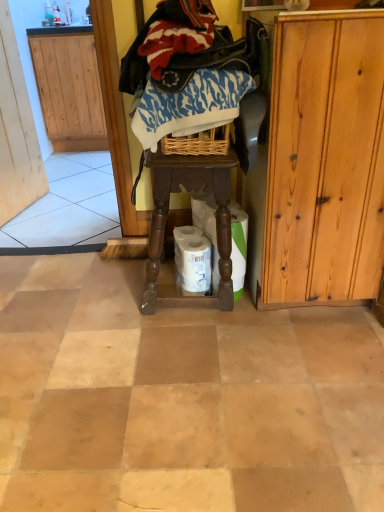
Question: Which direction should I rotate to face blue printed fabric at center, which is the 2th clothing in top-to-bottom order, — up or down?

Choices:
 (A) up
 (B) down

Answer: (A)

Question: Can you confirm if knitted wool sweater at upper center, placed as the first clothing when sorted from top to bottom, is wider than wooden screen door at left?

Choices:
 (A) no
 (B) yes

Answer: (B)

Question: Is knitted wool sweater at upper center, acting as the 2th clothing starting from the bottom, thinner than wooden screen door at left?

Choices:
 (A) yes
 (B) no

Answer: (B)

Question: Is knitted wool sweater at upper center, placed as the first clothing when sorted from top to bottom, at the right side of wooden screen door at left?

Choices:
 (A) yes
 (B) no

Answer: (A)

Question: Is the position of knitted wool sweater at upper center, acting as the 2th clothing starting from the bottom, more distant than that of wooden screen door at left?

Choices:
 (A) yes
 (B) no

Answer: (B)

Question: Is knitted wool sweater at upper center, acting as the 2th clothing starting from the bottom, positioned in front of wooden screen door at left?

Choices:
 (A) yes
 (B) no

Answer: (A)

Question: Could wooden screen door at left be considered to be inside knitted wool sweater at upper center, placed as the first clothing when sorted from top to bottom?

Choices:
 (A) yes
 (B) no

Answer: (B)

Question: Is knitted wool sweater at upper center, placed as the first clothing when sorted from top to bottom, taller than white matte toilet paper at center, acting as the 1th toilet paper starting from the right?

Choices:
 (A) yes
 (B) no

Answer: (B)

Question: From a real-world perspective, is knitted wool sweater at upper center, acting as the 2th clothing starting from the bottom, located higher than white matte toilet paper at center, which is the second toilet paper from left to right?

Choices:
 (A) yes
 (B) no

Answer: (A)

Question: Considering the relative positions of knitted wool sweater at upper center, placed as the first clothing when sorted from top to bottom, and white matte toilet paper at center, which is the second toilet paper from left to right, in the image provided, is knitted wool sweater at upper center, placed as the first clothing when sorted from top to bottom, to the right of white matte toilet paper at center, which is the second toilet paper from left to right, from the viewer's perspective?

Choices:
 (A) no
 (B) yes

Answer: (A)

Question: Can you confirm if knitted wool sweater at upper center, placed as the first clothing when sorted from top to bottom, is wider than white matte toilet paper at center, which is the second toilet paper from left to right?

Choices:
 (A) yes
 (B) no

Answer: (A)

Question: From the image's perspective, is knitted wool sweater at upper center, acting as the 2th clothing starting from the bottom, located beneath white matte toilet paper at center, acting as the 1th toilet paper starting from the right?

Choices:
 (A) yes
 (B) no

Answer: (B)

Question: Is knitted wool sweater at upper center, acting as the 2th clothing starting from the bottom, thinner than white matte toilet paper at center, acting as the 1th toilet paper starting from the right?

Choices:
 (A) yes
 (B) no

Answer: (B)

Question: From the image's perspective, is wooden screen door at left located above knitted wool sweater at upper center, acting as the 2th clothing starting from the bottom?

Choices:
 (A) no
 (B) yes

Answer: (B)